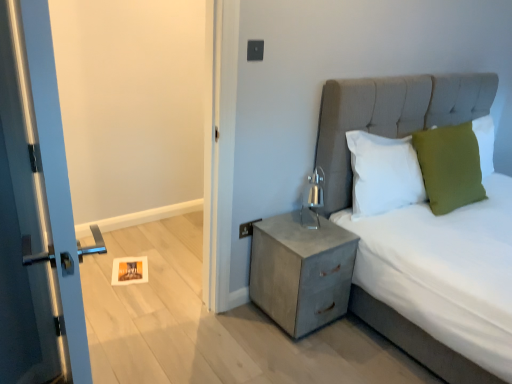
In the scene shown: What is the approximate height of green fabric pillow at upper right, the second pillow viewed from the right?

It is 23.74 inches.

The height and width of the screenshot is (384, 512). Find the location of `green fabric pillow at upper right, the 2th pillow when ordered from left to right`. green fabric pillow at upper right, the 2th pillow when ordered from left to right is located at coordinates (449, 166).

Measure the distance between point (x=249, y=223) and camera.

They are 7.34 feet apart.

Identify the location of metallic silver door at left. (36, 213).

The width and height of the screenshot is (512, 384). Identify the location of metallic gray nightstand at lower right. (301, 271).

At what (x,y) coordinates should I click in order to perform the action: click on textured gray bed at center. Please return your answer as a coordinate pair (x, y). Image resolution: width=512 pixels, height=384 pixels. Looking at the image, I should click on (390, 117).

Image resolution: width=512 pixels, height=384 pixels. What do you see at coordinates (383, 173) in the screenshot?
I see `white soft pillow at upper right, arranged as the 1th pillow when viewed from the left` at bounding box center [383, 173].

The image size is (512, 384). Find the location of `green fabric pillow at upper right, positioned as the third pillow in left-to-right order`. green fabric pillow at upper right, positioned as the third pillow in left-to-right order is located at coordinates (x=485, y=143).

The height and width of the screenshot is (384, 512). I want to click on green fabric pillow at upper right, the second pillow viewed from the right, so click(449, 166).

From the image's perspective, which one is positioned lower, white soft pillow at upper right, which appears as the 3th pillow when viewed from the right, or metallic gray electric outlet at upper right?

metallic gray electric outlet at upper right appears lower in the image.

Does white soft pillow at upper right, which appears as the 3th pillow when viewed from the right, have a smaller size compared to metallic gray electric outlet at upper right?

Incorrect, white soft pillow at upper right, which appears as the 3th pillow when viewed from the right, is not smaller in size than metallic gray electric outlet at upper right.

Does white soft pillow at upper right, which appears as the 3th pillow when viewed from the right, have a greater width compared to metallic gray electric outlet at upper right?

Yes.

Can you confirm if metallic silver door at left is shorter than white soft pillow at upper right, which appears as the 3th pillow when viewed from the right?

No.

Where is `door lying below the white soft pillow at upper right, which appears as the 3th pillow when viewed from the right (from the image's perspective)`? door lying below the white soft pillow at upper right, which appears as the 3th pillow when viewed from the right (from the image's perspective) is located at coordinates (36, 213).

Is metallic silver door at left bigger than white soft pillow at upper right, which appears as the 3th pillow when viewed from the right?

Yes, metallic silver door at left is bigger than white soft pillow at upper right, which appears as the 3th pillow when viewed from the right.

Which object is closer to the camera, metallic silver door at left or white soft pillow at upper right, arranged as the 1th pillow when viewed from the left?

metallic silver door at left is closer to the camera.

Is metallic silver door at left next to green fabric pillow at upper right, positioned as the third pillow in left-to-right order?

metallic silver door at left and green fabric pillow at upper right, positioned as the third pillow in left-to-right order, are clearly separated.

Find the location of a particular element. Image resolution: width=512 pixels, height=384 pixels. door that is in front of the green fabric pillow at upper right, arranged as the 1th pillow when viewed from the right is located at coordinates (36, 213).

Considering the points (37, 336) and (479, 148), which point is behind, point (37, 336) or point (479, 148)?

The point (479, 148) is farther from the camera.

From the image's perspective, relative to green fabric pillow at upper right, arranged as the 1th pillow when viewed from the right, is metallic silver door at left above or below?

From the image's perspective, metallic silver door at left appears below green fabric pillow at upper right, arranged as the 1th pillow when viewed from the right.

Is point (481, 149) positioned in front of point (358, 91)?

That is False.

Does green fabric pillow at upper right, positioned as the third pillow in left-to-right order, have a greater height compared to textured gray bed at center?

No, green fabric pillow at upper right, positioned as the third pillow in left-to-right order, is not taller than textured gray bed at center.

Would you say green fabric pillow at upper right, arranged as the 1th pillow when viewed from the right, is outside textured gray bed at center?

No, most part of green fabric pillow at upper right, arranged as the 1th pillow when viewed from the right, lies within textured gray bed at center.

Is green fabric pillow at upper right, arranged as the 1th pillow when viewed from the right, bigger than textured gray bed at center?

No.

Is metallic gray nightstand at lower right turned away from metallic gray electric outlet at upper right?

Yes, metallic gray electric outlet at upper right is at the back of metallic gray nightstand at lower right.

Which is less distant, (335, 287) or (246, 232)?

Point (335, 287).

Considering the sizes of metallic gray nightstand at lower right and metallic gray electric outlet at upper right in the image, is metallic gray nightstand at lower right bigger or smaller than metallic gray electric outlet at upper right?

Clearly, metallic gray nightstand at lower right is larger in size than metallic gray electric outlet at upper right.

In the image, is metallic gray nightstand at lower right positioned in front of or behind metallic gray electric outlet at upper right?

In the image, metallic gray nightstand at lower right appears in front of metallic gray electric outlet at upper right.

Is green fabric pillow at upper right, the second pillow viewed from the right, in contact with metallic gray electric outlet at upper right?

No, green fabric pillow at upper right, the second pillow viewed from the right, is not with metallic gray electric outlet at upper right.

Considering the relative sizes of green fabric pillow at upper right, the second pillow viewed from the right, and metallic gray electric outlet at upper right in the image provided, is green fabric pillow at upper right, the second pillow viewed from the right, thinner than metallic gray electric outlet at upper right?

No.

How many degrees apart are the facing directions of green fabric pillow at upper right, the 2th pillow when ordered from left to right, and metallic gray electric outlet at upper right?

green fabric pillow at upper right, the 2th pillow when ordered from left to right, and metallic gray electric outlet at upper right are facing 5.49 degrees away from each other.

Which object is positioned more to the right, green fabric pillow at upper right, the 2th pillow when ordered from left to right, or metallic gray electric outlet at upper right?

green fabric pillow at upper right, the 2th pillow when ordered from left to right.

I want to click on nightstand below the green fabric pillow at upper right, the 2th pillow when ordered from left to right (from a real-world perspective), so click(301, 271).

How many degrees apart are the facing directions of green fabric pillow at upper right, the 2th pillow when ordered from left to right, and metallic gray nightstand at lower right?

4.38 degrees.

Is green fabric pillow at upper right, the 2th pillow when ordered from left to right, touching metallic gray nightstand at lower right?

No, green fabric pillow at upper right, the 2th pillow when ordered from left to right, is not next to metallic gray nightstand at lower right.

Is green fabric pillow at upper right, the 2th pillow when ordered from left to right, oriented away from metallic gray nightstand at lower right?

green fabric pillow at upper right, the 2th pillow when ordered from left to right, is not turned away from metallic gray nightstand at lower right.

This screenshot has width=512, height=384. Identify the location of the 1st pillow above when counting from the metallic gray electric outlet at upper right (from the image's perspective). (383, 173).

This screenshot has width=512, height=384. Identify the location of door below the white soft pillow at upper right, which appears as the 3th pillow when viewed from the right (from the image's perspective). (36, 213).

When comparing their distances from green fabric pillow at upper right, positioned as the third pillow in left-to-right order, does white soft pillow at upper right, which appears as the 3th pillow when viewed from the right, or metallic silver door at left seem further?

Based on the image, metallic silver door at left appears to be further to green fabric pillow at upper right, positioned as the third pillow in left-to-right order.

Which object lies further to the anchor point metallic silver door at left, metallic gray nightstand at lower right or metallic gray electric outlet at upper right?

metallic gray nightstand at lower right is further to metallic silver door at left.

Which object lies nearer to the anchor point metallic gray electric outlet at upper right, metallic silver door at left or textured gray bed at center?

Among the two, textured gray bed at center is located nearer to metallic gray electric outlet at upper right.

Looking at the image, which one is located closer to green fabric pillow at upper right, positioned as the third pillow in left-to-right order, metallic gray electric outlet at upper right or metallic gray nightstand at lower right?

metallic gray nightstand at lower right is closer to green fabric pillow at upper right, positioned as the third pillow in left-to-right order.

Consider the image. Estimate the real-world distances between objects in this image. Which object is further from green fabric pillow at upper right, positioned as the third pillow in left-to-right order, white soft pillow at upper right, which appears as the 3th pillow when viewed from the right, or metallic gray nightstand at lower right?

metallic gray nightstand at lower right lies further to green fabric pillow at upper right, positioned as the third pillow in left-to-right order, than the other object.

Based on the photo, estimate the real-world distances between objects in this image. Which object is further from metallic gray electric outlet at upper right, textured gray bed at center or green fabric pillow at upper right, positioned as the third pillow in left-to-right order?

green fabric pillow at upper right, positioned as the third pillow in left-to-right order, lies further to metallic gray electric outlet at upper right than the other object.

Looking at the image, which one is located further to metallic gray electric outlet at upper right, metallic gray nightstand at lower right or white soft pillow at upper right, which appears as the 3th pillow when viewed from the right?

Based on the image, white soft pillow at upper right, which appears as the 3th pillow when viewed from the right, appears to be further to metallic gray electric outlet at upper right.

Looking at the image, which one is located further to green fabric pillow at upper right, positioned as the third pillow in left-to-right order, metallic gray nightstand at lower right or textured gray bed at center?

metallic gray nightstand at lower right is positioned further to the anchor green fabric pillow at upper right, positioned as the third pillow in left-to-right order.

You are a GUI agent. You are given a task and a screenshot of the screen. Output one action in this format:
    pyautogui.click(x=<x>, y=<y>)
    Task: Click on the nightstand between metallic gray electric outlet at upper right and green fabric pillow at upper right, the 2th pillow when ordered from left to right, in the horizontal direction
    
    Given the screenshot: What is the action you would take?
    pyautogui.click(x=301, y=271)

At what (x,y) coordinates should I click in order to perform the action: click on electric outlet between metallic silver door at left and green fabric pillow at upper right, the second pillow viewed from the right, in the horizontal direction. Please return your answer as a coordinate pair (x, y). Looking at the image, I should click on (247, 228).

This screenshot has width=512, height=384. I want to click on nightstand located between metallic silver door at left and green fabric pillow at upper right, positioned as the third pillow in left-to-right order, in the left-right direction, so click(x=301, y=271).

Identify the location of pillow situated between metallic gray nightstand at lower right and green fabric pillow at upper right, the second pillow viewed from the right, from left to right. This screenshot has height=384, width=512. (383, 173).